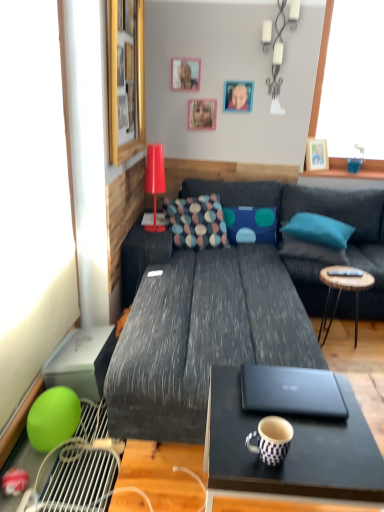
I want to click on free space in front of blue and white checkered coffee cup at lower center, so click(273, 476).